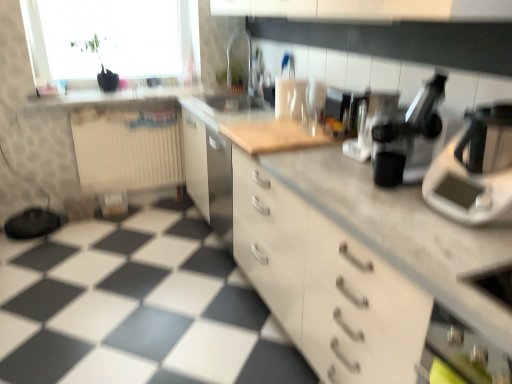
Question: Considering the relative sizes of white plastic scale at right and white matte cabinet at center in the image provided, is white plastic scale at right taller than white matte cabinet at center?

Choices:
 (A) no
 (B) yes

Answer: (A)

Question: Does white plastic scale at right turn towards white matte cabinet at center?

Choices:
 (A) no
 (B) yes

Answer: (A)

Question: Is white matte cabinet at center at the back of white plastic scale at right?

Choices:
 (A) no
 (B) yes

Answer: (A)

Question: Is white plastic scale at right at the right side of white matte cabinet at center?

Choices:
 (A) yes
 (B) no

Answer: (A)

Question: From the image's perspective, is white plastic scale at right below white matte cabinet at center?

Choices:
 (A) no
 (B) yes

Answer: (A)

Question: Are white plastic scale at right and white matte cabinet at center beside each other?

Choices:
 (A) yes
 (B) no

Answer: (B)

Question: Is the surface of black plastic coffee machine at center, placed as the second coffee machine when sorted from back to front, in direct contact with transparent glass sink at center?

Choices:
 (A) yes
 (B) no

Answer: (B)

Question: Is the position of black plastic coffee machine at center, arranged as the 2th coffee machine when viewed from the front, more distant than that of transparent glass sink at center?

Choices:
 (A) no
 (B) yes

Answer: (A)

Question: Is black plastic coffee machine at center, arranged as the 2th coffee machine when viewed from the front, facing away from transparent glass sink at center?

Choices:
 (A) yes
 (B) no

Answer: (B)

Question: Is transparent glass sink at center inside black plastic coffee machine at center, placed as the second coffee machine when sorted from back to front?

Choices:
 (A) yes
 (B) no

Answer: (B)

Question: Does black plastic coffee machine at center, arranged as the 2th coffee machine when viewed from the front, turn towards transparent glass sink at center?

Choices:
 (A) yes
 (B) no

Answer: (B)

Question: Is there a large distance between black plastic coffee machine at center, placed as the second coffee machine when sorted from back to front, and transparent glass sink at center?

Choices:
 (A) yes
 (B) no

Answer: (A)

Question: From a real-world perspective, is beige ribbed radiator at left on top of transparent glass sink at center?

Choices:
 (A) yes
 (B) no

Answer: (B)